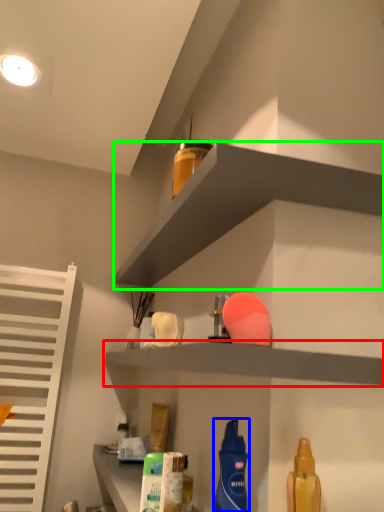
Question: Estimate the real-world distances between objects in this image. Which object is closer to shelf (highlighted by a red box), cleaning product (highlighted by a blue box) or shelf (highlighted by a green box)?

Choices:
 (A) cleaning product
 (B) shelf

Answer: (A)